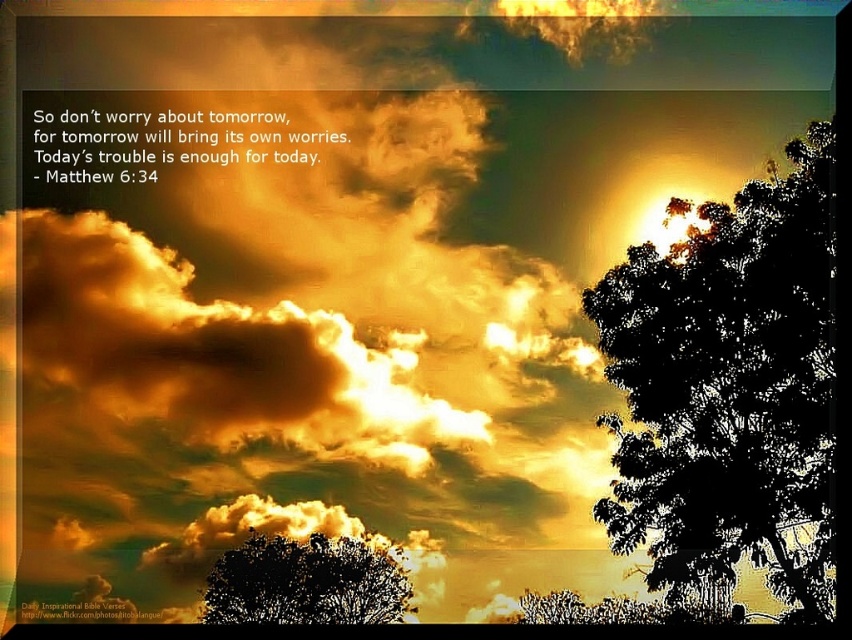
Is point (674, 360) positioned in front of point (242, 608)?

Yes, it is in front of point (242, 608).

Based on the photo, does black leafy tree at right have a lesser width compared to dark green leafy tree at center?

Incorrect, black leafy tree at right's width is not less than dark green leafy tree at center's.

Between point (707, 372) and point (315, 593), which one is positioned in front?

Positioned in front is point (707, 372).

Locate an element on the screen. This screenshot has height=640, width=852. black leafy tree at right is located at coordinates (729, 387).